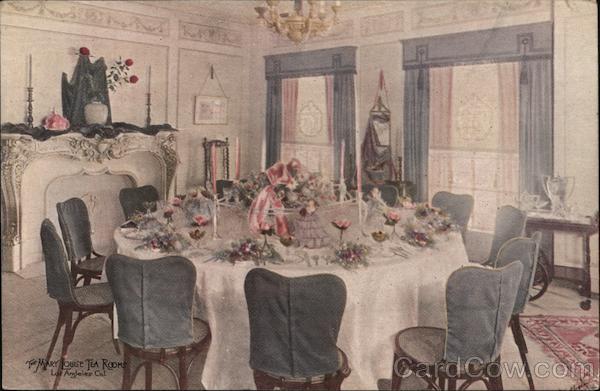
Locate an element on the screen. This screenshot has height=391, width=600. bar cart is located at coordinates (582, 228).